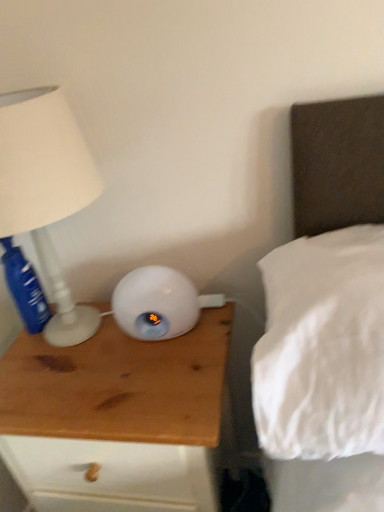
I want to click on free space in front of white matte lamp at left, so click(x=91, y=398).